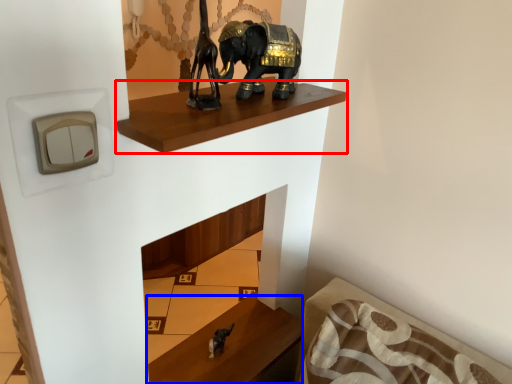
Question: Which object is closer to the camera taking this photo, shelf (highlighted by a red box) or furniture (highlighted by a blue box)?

Choices:
 (A) shelf
 (B) furniture

Answer: (A)